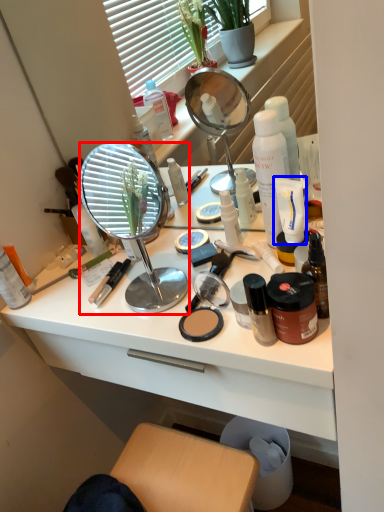
Question: Which of the following is the closest to the observer, mirror (highlighted by a red box) or product (highlighted by a blue box)?

Choices:
 (A) mirror
 (B) product

Answer: (A)